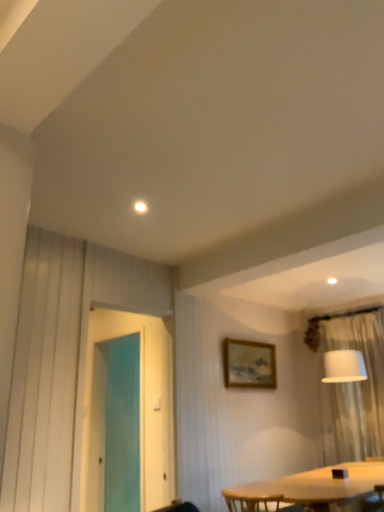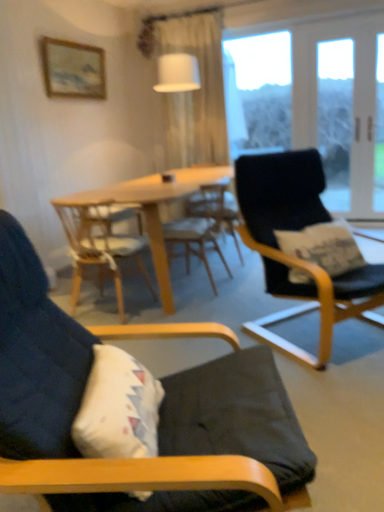
Question: How did the camera likely rotate when shooting the video?

Choices:
 (A) rotated right
 (B) rotated left

Answer: (A)